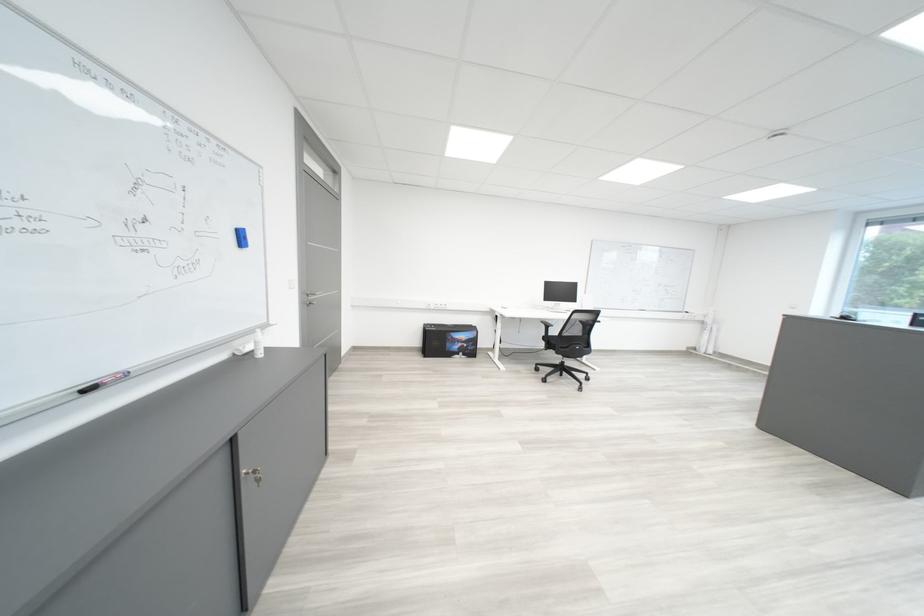
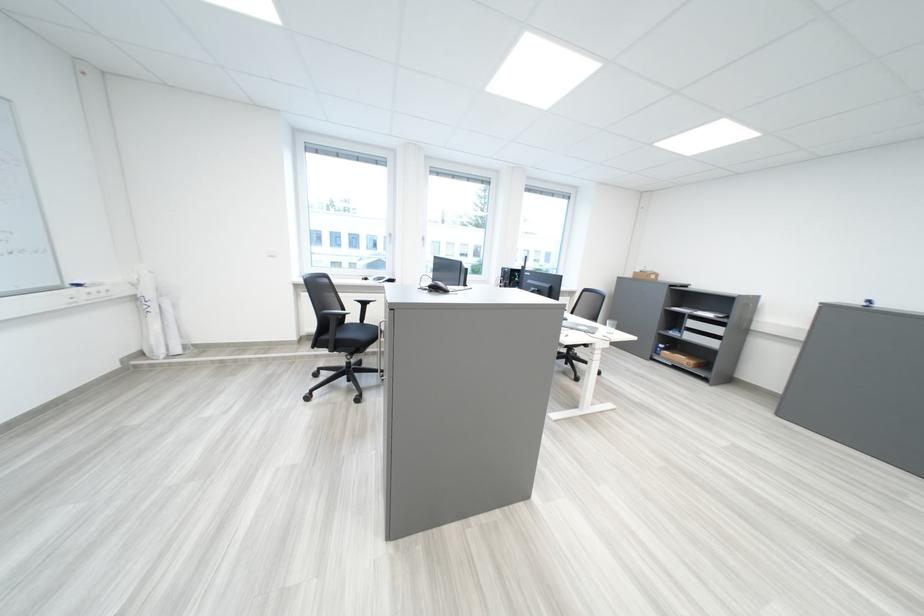
The point at (720, 334) is marked in the first image. Where is the corresponding point in the second image?

(166, 318)